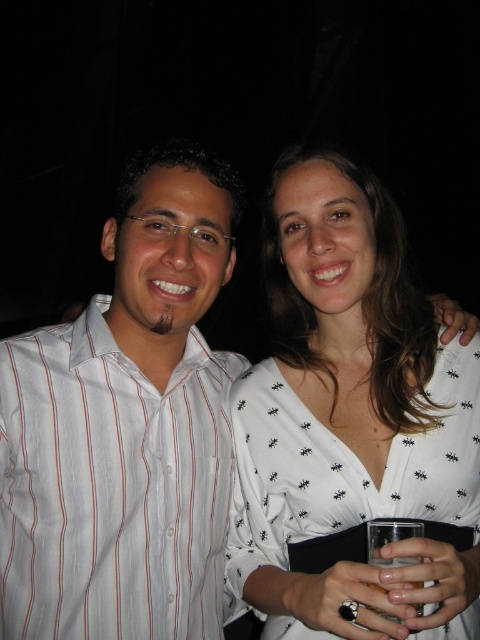
Locate an element on the screen. white printed dress at center is located at coordinates (344, 474).

Describe the element at coordinates (344, 474) in the screenshot. I see `white printed dress at center` at that location.

Between point (245, 401) and point (370, 552), which one is positioned in front?

Point (370, 552) is more forward.

The image size is (480, 640). In order to click on white printed dress at center in this screenshot , I will do `click(344, 474)`.

Can you confirm if white striped shirt at left is bigger than white printed dress at center?

No, white striped shirt at left is not bigger than white printed dress at center.

The height and width of the screenshot is (640, 480). Describe the element at coordinates (111, 486) in the screenshot. I see `white striped shirt at left` at that location.

Identify the location of white striped shirt at left. This screenshot has height=640, width=480. (111, 486).

Does white striped shirt at left lie in front of clear glass at lower center?

No, white striped shirt at left is further to the viewer.

Does point (131, 620) come farther from viewer compared to point (408, 586)?

Yes.

Where is `white striped shirt at left`? The width and height of the screenshot is (480, 640). white striped shirt at left is located at coordinates (111, 486).